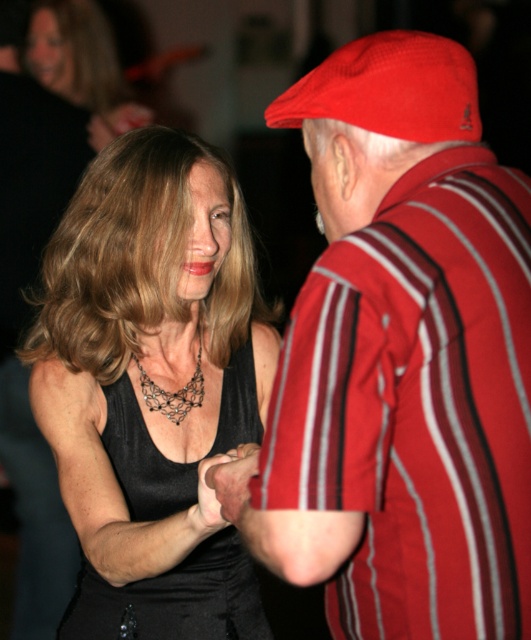
You are a photographer trying to capture the dance scene. You want to ensure both the red fabric cap at upper right and the black satin dress at center are clearly visible. Given their sizes, which object should you focus on first to ensure it doesn

The red fabric cap at upper right is bigger than the black satin dress at center, so you should focus on the red fabric cap at upper right first to ensure it is clearly visible before adjusting for the smaller black satin dress at center.

You are a photographer trying to capture the perfect shot of the dance scene. You want to place your focus on the red fabric cap at upper right. According to the coordinates provided, where should you aim your camera to ensure the cap is centered in the frame?

To center the red fabric cap at upper right in your frame, aim your camera at the coordinates point (400,358) as the cap is located there.